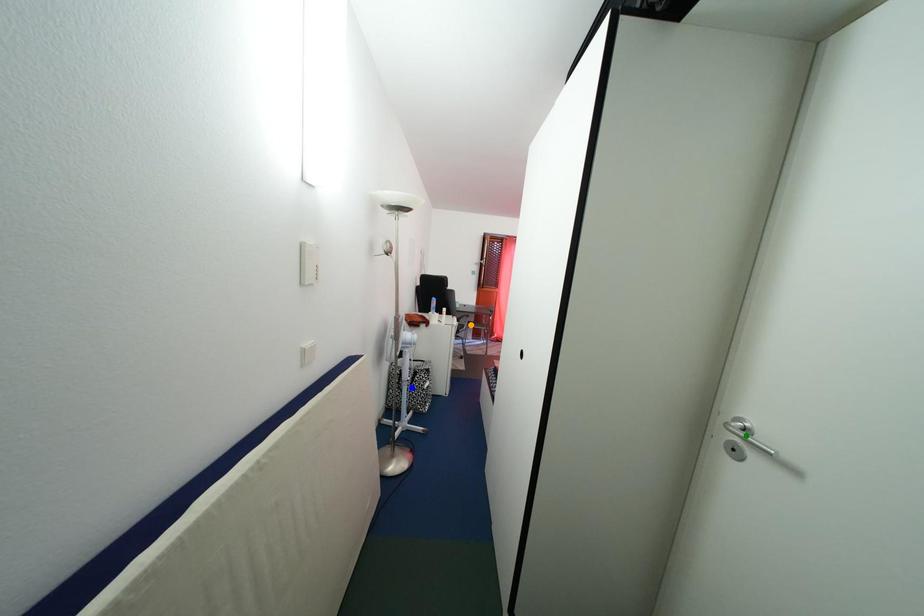
Order these from nearest to farthest:
green point
orange point
blue point

orange point → blue point → green point